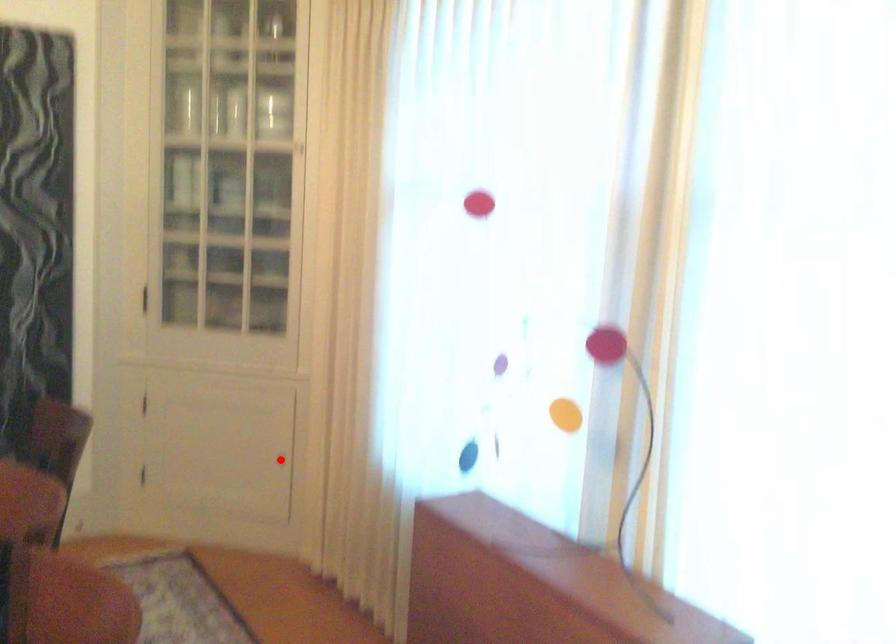
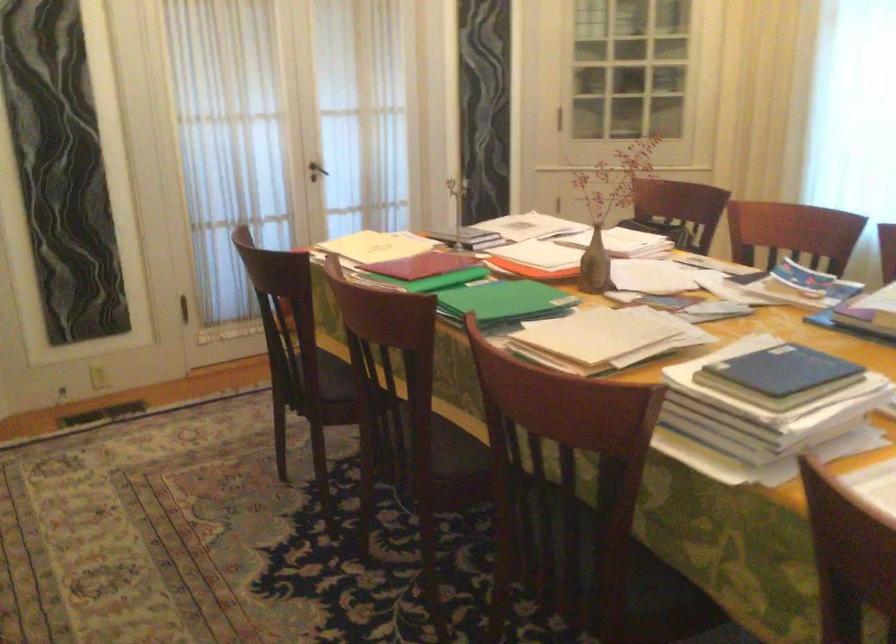
Question: I am providing you with two images of the same scene from different viewpoints. A red point is marked on the first image. Can you still see the location of the red point in image 2?

Choices:
 (A) Yes
 (B) No

Answer: (B)